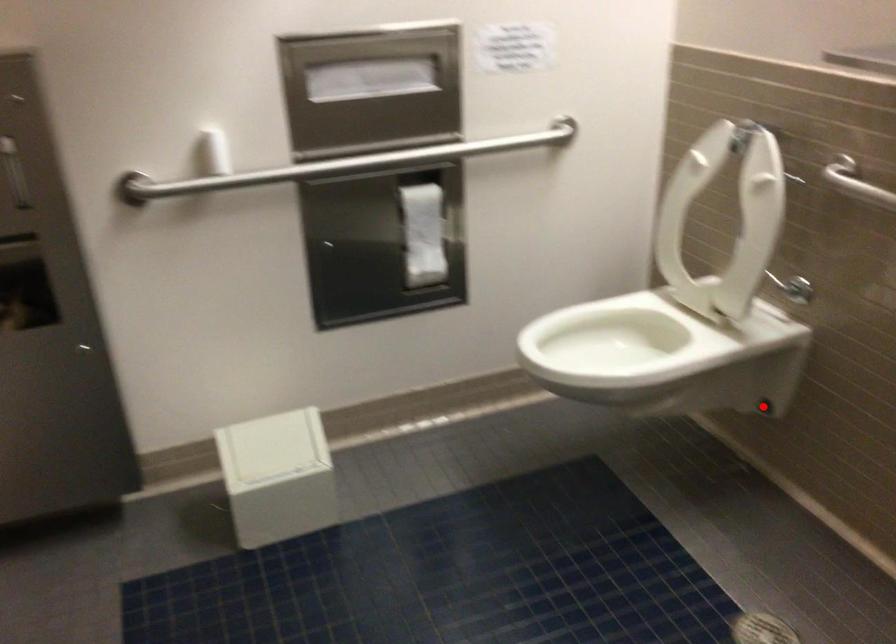
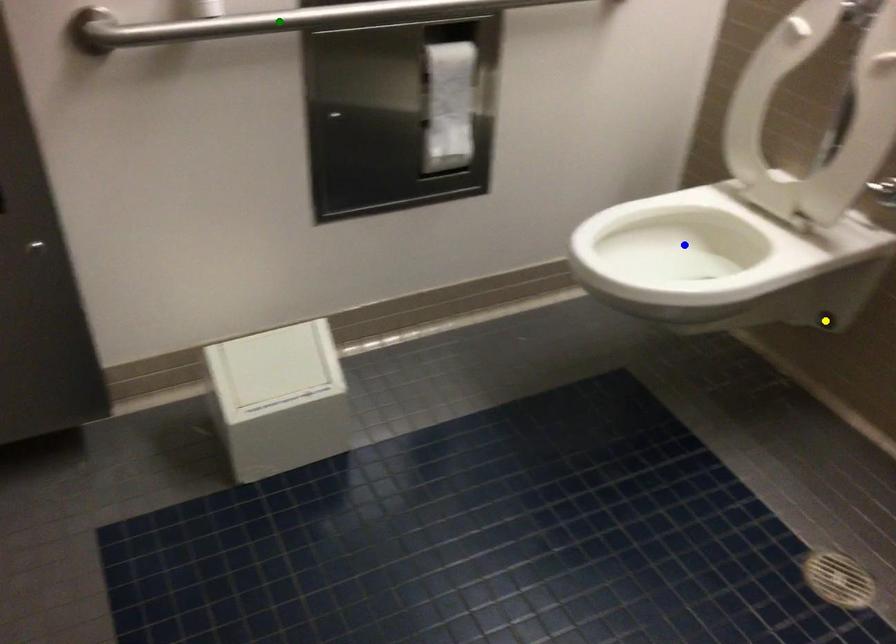
Question: I am providing you with two images of the same scene from different viewpoints. A red point is marked on the first image. You are given multiple points on the second image. Which mark in image 2 goes with the point in image 1?

Choices:
 (A) green point
 (B) yellow point
 (C) blue point

Answer: (B)